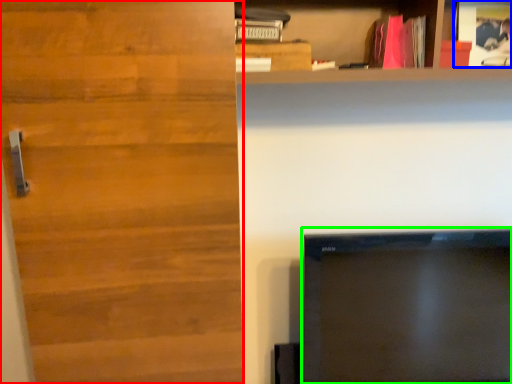
Question: Considering the real-world distances, which object is farthest from door (highlighted by a red box)? book (highlighted by a blue box) or television (highlighted by a green box)?

Choices:
 (A) book
 (B) television

Answer: (A)